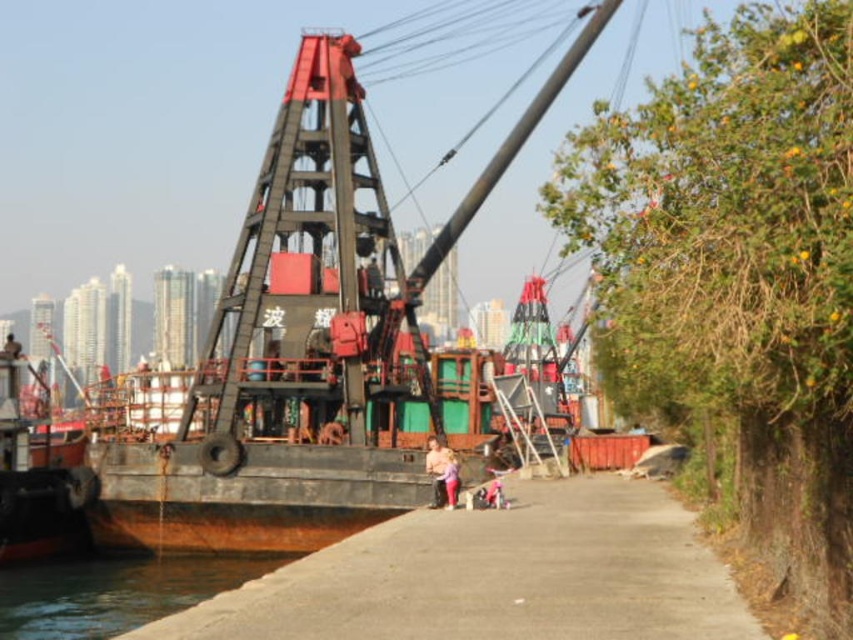
In the scene shown: You are standing at the position of point (444, 458) and want to walk towards the camera. Can you reach point (22, 572) without moving backward?

Yes, because point (22, 572) is further to the camera than point (444, 458), so walking forward from your current position will bring you closer to it.

You are standing on the dock and see the clear water at lower left and the pink fabric pants at lower center. Which object takes up more space in the image?

The clear water at lower left takes up more space in the image because it is bigger than the pink fabric pants at lower center.